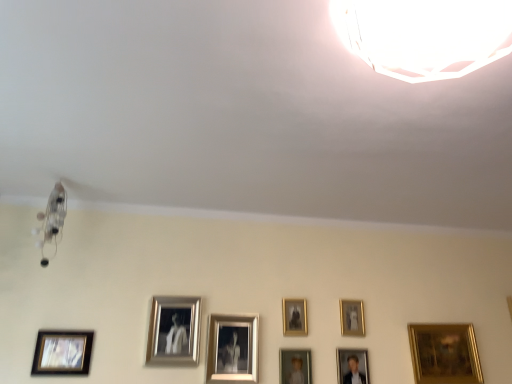
Question: In terms of height, does gold metallic picture frame at lower right, positioned as the eighth picture frame in left-to-right order, look taller or shorter compared to gold metallic picture frame at upper center, which ranks as the fourth picture frame in right-to-left order?

Choices:
 (A) short
 (B) tall

Answer: (B)

Question: Based on their sizes in the image, would you say gold metallic picture frame at lower right, positioned as the eighth picture frame in left-to-right order, is bigger or smaller than gold metallic picture frame at upper center, positioned as the 5th picture frame in left-to-right order?

Choices:
 (A) big
 (B) small

Answer: (A)

Question: Estimate the real-world distances between objects in this image. Which object is closer to the gold-framed photo at lower left, arranged as the 1th picture frame when viewed from the left?

Choices:
 (A) gold metallic picture frame at center, positioned as the sixth picture frame in right-to-left order
 (B) gold metallic picture frame at lower right, which is counted as the 1th picture frame, starting from the right
 (C) silver metallic picture frame at center, positioned as the 2th picture frame in left-to-right order
 (D) gold-framed portrait at center, which is the fourth picture frame from left to right
 (E) gold metallic picture frame at upper center, which ranks as the fourth picture frame in right-to-left order

Answer: (C)

Question: Which object is the farthest from the silver metallic picture frame at center, which is the seventh picture frame in right-to-left order?

Choices:
 (A) gold metallic picture frame at upper center, positioned as the 5th picture frame in left-to-right order
 (B) gold metallic picture frame at lower right, positioned as the eighth picture frame in left-to-right order
 (C) gold metallic picture frame at upper right, the seventh picture frame positioned from the left
 (D) gold metallic picture frame at center, positioned as the sixth picture frame in right-to-left order
 (E) gold-framed portrait at center, the 5th picture frame positioned from the right

Answer: (B)